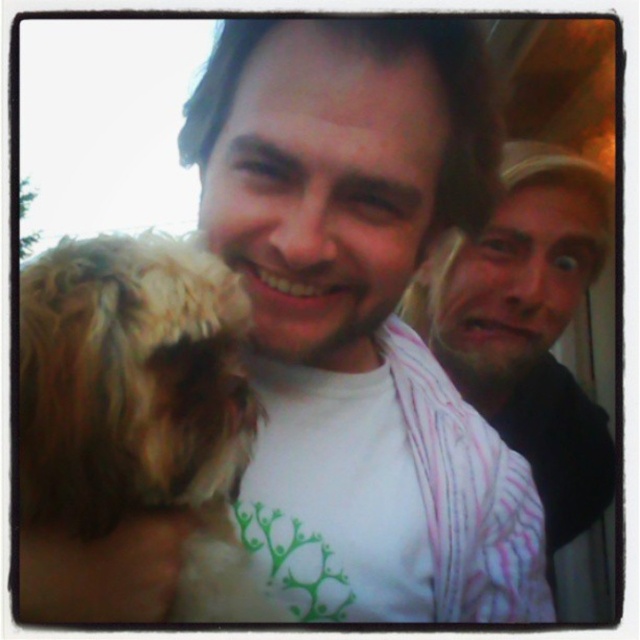
Between fuzzy brown dog at left and pink striped shirt at right, which one has less height?

With less height is fuzzy brown dog at left.

Does fuzzy brown dog at left appear on the left side of pink striped shirt at right?

Yes, fuzzy brown dog at left is to the left of pink striped shirt at right.

Between point (237, 355) and point (534, 429), which one is positioned behind?

The point (534, 429) is behind.

Locate an element on the screen. fuzzy brown dog at left is located at coordinates (140, 403).